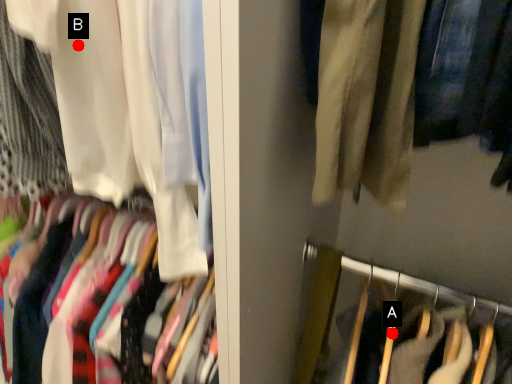
Question: Two points are circled on the image, labeled by A and B beside each circle. Which point appears farthest from the camera in this image?

Choices:
 (A) A is further
 (B) B is further

Answer: (A)